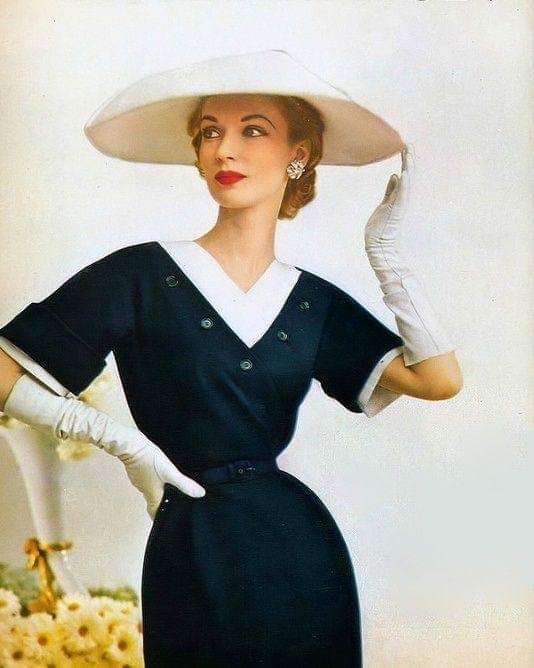
Where is `white vase`? This screenshot has width=534, height=668. white vase is located at coordinates (46, 484).